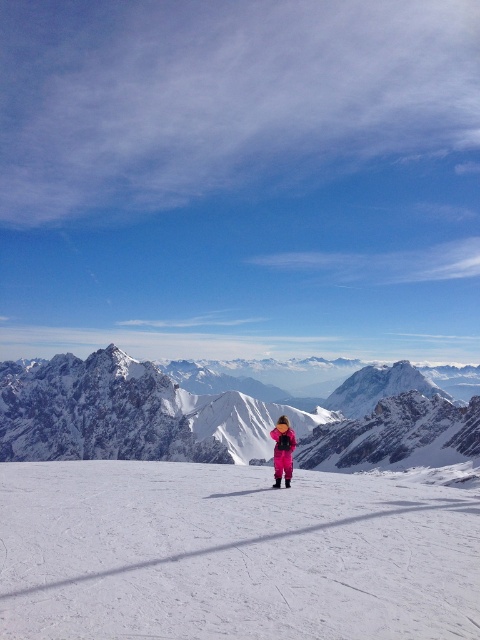
The height and width of the screenshot is (640, 480). I want to click on snowy rocky mountain at center, so click(224, 417).

Is snowy rocky mountain at center bigger than pink snowsuit at center?

Yes, snowy rocky mountain at center is bigger than pink snowsuit at center.

Is point (112, 353) farther from viewer compared to point (288, 468)?

Yes, point (112, 353) is farther from viewer.

Locate an element on the screen. snowy rocky mountain at center is located at coordinates (224, 417).

Is pink fabric ski slope at center above pink snowsuit at center?

No.

Which is below, pink fabric ski slope at center or pink snowsuit at center?

pink fabric ski slope at center is below.

The width and height of the screenshot is (480, 640). What do you see at coordinates (232, 554) in the screenshot?
I see `pink fabric ski slope at center` at bounding box center [232, 554].

Find the location of a particular element. The width and height of the screenshot is (480, 640). pink fabric ski slope at center is located at coordinates (232, 554).

You are a GUI agent. You are given a task and a screenshot of the screen. Output one action in this format:
    pyautogui.click(x=<x>, y=<y>)
    Task: Click on the pink snowsuit at center
    This screenshot has width=480, height=640.
    Given the screenshot: What is the action you would take?
    pyautogui.click(x=283, y=451)

Is pink snowsuit at center to the right of pink fabric ski at center from the viewer's perspective?

Yes, pink snowsuit at center is to the right of pink fabric ski at center.

This screenshot has width=480, height=640. Describe the element at coordinates (283, 451) in the screenshot. I see `pink snowsuit at center` at that location.

Identify the location of pink snowsuit at center. Image resolution: width=480 pixels, height=640 pixels. (283, 451).